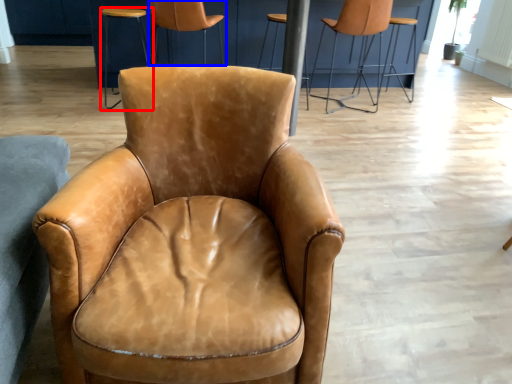
Question: Among these objects, which one is nearest to the camera, stool (highlighted by a red box) or chair (highlighted by a blue box)?

Choices:
 (A) stool
 (B) chair

Answer: (B)